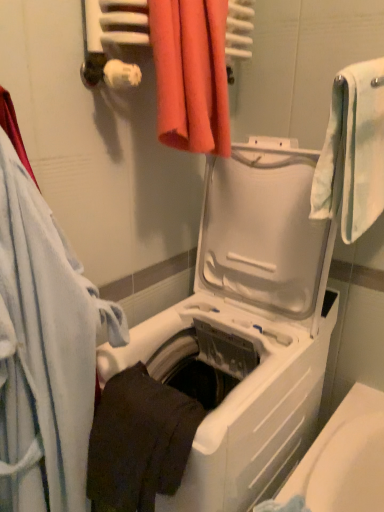
The image size is (384, 512). What do you see at coordinates (246, 328) in the screenshot?
I see `white plastic washing machine at center` at bounding box center [246, 328].

This screenshot has height=512, width=384. I want to click on orange fabric towel at upper center, the 2th towel when ordered from right to left, so click(191, 74).

Locate an element on the screen. white soft towel at left, the first towel viewed from the left is located at coordinates (44, 351).

Locate an element on the screen. dark matte towel at lower center, arranged as the second towel when viewed from the left is located at coordinates (139, 442).

How different are the orientations of orange fabric towel at upper center, the 2th towel when ordered from right to left, and white soft towel at left, the first towel viewed from the left, in degrees?

92.8 degrees.

Does point (170, 67) come closer to viewer compared to point (93, 342)?

No, it is behind (93, 342).

Considering the relative sizes of orange fabric towel at upper center, the third towel in the left-to-right sequence, and white soft towel at left, the first towel viewed from the left, in the image provided, is orange fabric towel at upper center, the third towel in the left-to-right sequence, smaller than white soft towel at left, the first towel viewed from the left,?

Correct, orange fabric towel at upper center, the third towel in the left-to-right sequence, occupies less space than white soft towel at left, the first towel viewed from the left.

From a real-world perspective, relative to white soft towel at left, which is the 4th towel from right to left, is orange fabric towel at upper center, the 2th towel when ordered from right to left, vertically above or below?

From a real-world perspective, orange fabric towel at upper center, the 2th towel when ordered from right to left, is physically above white soft towel at left, which is the 4th towel from right to left.

Is white plastic washing machine at center bigger than orange fabric towel at upper center, the 2th towel when ordered from right to left?

Yes, white plastic washing machine at center is bigger than orange fabric towel at upper center, the 2th towel when ordered from right to left.

Which object is further away from the camera taking this photo, white plastic washing machine at center or orange fabric towel at upper center, the 2th towel when ordered from right to left?

orange fabric towel at upper center, the 2th towel when ordered from right to left, is more distant.

From the image's perspective, would you say white plastic washing machine at center is shown under orange fabric towel at upper center, the third towel in the left-to-right sequence?

Indeed, from the image's perspective, white plastic washing machine at center is shown beneath orange fabric towel at upper center, the third towel in the left-to-right sequence.

Which of these two, orange fabric towel at upper center, the third towel in the left-to-right sequence, or white plastic washing machine at center, stands taller?

With more height is white plastic washing machine at center.

Is orange fabric towel at upper center, the third towel in the left-to-right sequence, with white plastic washing machine at center?

No.

Is orange fabric towel at upper center, the 2th towel when ordered from right to left, bigger than white plastic washing machine at center?

Incorrect, orange fabric towel at upper center, the 2th towel when ordered from right to left, is not larger than white plastic washing machine at center.

Could you tell me if orange fabric towel at upper center, the third towel in the left-to-right sequence, is facing white plastic washing machine at center?

No, orange fabric towel at upper center, the third towel in the left-to-right sequence, is not oriented towards white plastic washing machine at center.

Which is closer, (184, 81) or (322, 209)?

Point (184, 81).

From a real-world perspective, who is located lower, orange fabric towel at upper center, the 2th towel when ordered from right to left, or white soft towel at right, which is the fourth towel from left to right?

From a 3D spatial view, white soft towel at right, which is the fourth towel from left to right, is below.

Is white soft towel at right, which is the fourth towel from left to right, surrounded by orange fabric towel at upper center, the 2th towel when ordered from right to left?

No, white soft towel at right, which is the fourth towel from left to right, is not inside orange fabric towel at upper center, the 2th towel when ordered from right to left.

Which object is further away from the camera taking this photo, orange fabric towel at upper center, the 2th towel when ordered from right to left, or white soft towel at right, which is the fourth towel from left to right?

orange fabric towel at upper center, the 2th towel when ordered from right to left, is behind.

From a real-world perspective, is white plastic washing machine at center positioned above or below white soft towel at right, which is the fourth towel from left to right?

In terms of real-world spatial position, white plastic washing machine at center is below white soft towel at right, which is the fourth towel from left to right.

Which of these two, white plastic washing machine at center or white soft towel at right, the first towel positioned from the right, is wider?

Wider between the two is white plastic washing machine at center.

From the image's perspective, is white plastic washing machine at center positioned above or below white soft towel at right, which is the fourth towel from left to right?

From the image's perspective, white plastic washing machine at center appears below white soft towel at right, which is the fourth towel from left to right.

Which is more to the right, white plastic washing machine at center or white soft towel at right, the first towel positioned from the right?

white soft towel at right, the first towel positioned from the right, is more to the right.

Does white soft towel at left, the first towel viewed from the left, lie in front of white plastic washing machine at center?

Yes, it is in front of white plastic washing machine at center.

Does point (84, 322) come in front of point (277, 160)?

Yes, it is.

The width and height of the screenshot is (384, 512). What are the coordinates of `washing machine behind the white soft towel at left, the first towel viewed from the left` in the screenshot? It's located at (246, 328).

Is white soft towel at left, which is the 4th towel from right to left, taller or shorter than white plastic washing machine at center?

Considering their sizes, white soft towel at left, which is the 4th towel from right to left, has less height than white plastic washing machine at center.

From a real-world perspective, between white soft towel at right, which is the fourth towel from left to right, and white soft towel at left, which is the 4th towel from right to left, who is vertically higher?

In real-world perspective, white soft towel at right, which is the fourth towel from left to right, is above.

From their relative heights in the image, would you say white soft towel at right, the first towel positioned from the right, is taller or shorter than white soft towel at left, the first towel viewed from the left?

Considering their sizes, white soft towel at right, the first towel positioned from the right, has less height than white soft towel at left, the first towel viewed from the left.

In the scene shown: Considering the relative positions of white soft towel at right, which is the fourth towel from left to right, and white soft towel at left, the first towel viewed from the left, in the image provided, is white soft towel at right, which is the fourth towel from left to right, to the left or to the right of white soft towel at left, the first towel viewed from the left,?

Based on their positions, white soft towel at right, which is the fourth towel from left to right, is located to the right of white soft towel at left, the first towel viewed from the left.

Does point (383, 98) appear closer or farther from the camera than point (39, 341)?

Point (383, 98).

Identify the location of the 2nd towel counting from the left of the orange fabric towel at upper center, the 2th towel when ordered from right to left. The width and height of the screenshot is (384, 512). (44, 351).

Locate an element on the screen. washing machine below the orange fabric towel at upper center, the 2th towel when ordered from right to left (from a real-world perspective) is located at coordinates (246, 328).

From the picture: Considering their positions, is dark matte towel at lower center, arranged as the second towel when viewed from the left, positioned further to white soft towel at right, which is the fourth towel from left to right, than white plastic washing machine at center?

Based on the image, dark matte towel at lower center, arranged as the second towel when viewed from the left, appears to be further to white soft towel at right, which is the fourth towel from left to right.

Estimate the real-world distances between objects in this image. Which object is closer to white soft towel at left, the first towel viewed from the left, orange fabric towel at upper center, the third towel in the left-to-right sequence, or white plastic washing machine at center?

Based on the image, white plastic washing machine at center appears to be nearer to white soft towel at left, the first towel viewed from the left.

Looking at the image, which one is located further to white soft towel at left, which is the 4th towel from right to left, orange fabric towel at upper center, the third towel in the left-to-right sequence, or white soft towel at right, which is the fourth towel from left to right?

white soft towel at right, which is the fourth towel from left to right, lies further to white soft towel at left, which is the 4th towel from right to left, than the other object.

Which object lies further to the anchor point orange fabric towel at upper center, the third towel in the left-to-right sequence, white soft towel at left, which is the 4th towel from right to left, or dark matte towel at lower center, which is counted as the third towel, starting from the right?

Among the two, dark matte towel at lower center, which is counted as the third towel, starting from the right, is located further to orange fabric towel at upper center, the third towel in the left-to-right sequence.

Which object lies further to the anchor point orange fabric towel at upper center, the 2th towel when ordered from right to left, white soft towel at left, which is the 4th towel from right to left, or white soft towel at right, which is the fourth towel from left to right?

white soft towel at left, which is the 4th towel from right to left, is positioned further to the anchor orange fabric towel at upper center, the 2th towel when ordered from right to left.

Looking at the image, which one is located closer to white soft towel at left, which is the 4th towel from right to left, dark matte towel at lower center, which is counted as the third towel, starting from the right, or white plastic washing machine at center?

Based on the image, dark matte towel at lower center, which is counted as the third towel, starting from the right, appears to be nearer to white soft towel at left, which is the 4th towel from right to left.

Estimate the real-world distances between objects in this image. Which object is closer to dark matte towel at lower center, which is counted as the third towel, starting from the right, white soft towel at left, the first towel viewed from the left, or orange fabric towel at upper center, the 2th towel when ordered from right to left?

white soft towel at left, the first towel viewed from the left, is closer to dark matte towel at lower center, which is counted as the third towel, starting from the right.

When comparing their distances from white soft towel at right, the first towel positioned from the right, does white plastic washing machine at center or white soft towel at left, which is the 4th towel from right to left, seem further?

white soft towel at left, which is the 4th towel from right to left, is positioned further to the anchor white soft towel at right, the first towel positioned from the right.

You are a GUI agent. You are given a task and a screenshot of the screen. Output one action in this format:
    pyautogui.click(x=<x>, y=<y>)
    Task: Click on the washing machine between white soft towel at right, which is the fourth towel from left to right, and dark matte towel at lower center, which is counted as the third towel, starting from the right, in the vertical direction
    The height and width of the screenshot is (512, 384).
    Given the screenshot: What is the action you would take?
    pyautogui.click(x=246, y=328)

You are a GUI agent. You are given a task and a screenshot of the screen. Output one action in this format:
    pyautogui.click(x=<x>, y=<y>)
    Task: Click on the washing machine between orange fabric towel at upper center, the 2th towel when ordered from right to left, and dark matte towel at lower center, which is counted as the third towel, starting from the right, vertically
    Image resolution: width=384 pixels, height=512 pixels.
    Given the screenshot: What is the action you would take?
    pyautogui.click(x=246, y=328)

The image size is (384, 512). I want to click on washing machine situated between white soft towel at left, which is the 4th towel from right to left, and white soft towel at right, the first towel positioned from the right, from left to right, so click(x=246, y=328).